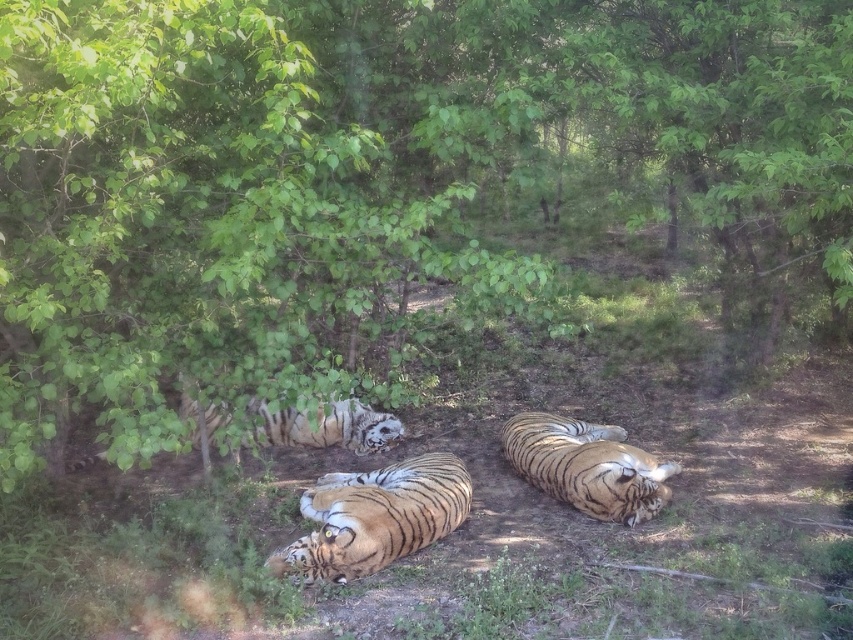
You are a GUI agent. You are given a task and a screenshot of the screen. Output one action in this format:
    pyautogui.click(x=<x>, y=<y>)
    Task: Click on the orange striped tiger at center
    The height and width of the screenshot is (640, 853).
    Given the screenshot: What is the action you would take?
    pyautogui.click(x=375, y=516)

Can you confirm if orange striped tiger at center is positioned below white fur tiger at center?

Yes.

Identify the location of orange striped tiger at center. This screenshot has height=640, width=853. (375, 516).

Who is more forward, (556, 481) or (292, 412)?

Point (556, 481) is more forward.

Is point (538, 451) positioned before point (392, 416)?

Yes, it is.

The image size is (853, 640). In order to click on orange striped tiger at lower right in this screenshot , I will do `click(587, 467)`.

Is point (322, 506) closer to viewer compared to point (602, 458)?

That is True.

Does orange striped tiger at center have a lesser width compared to orange striped tiger at lower right?

Yes, orange striped tiger at center is thinner than orange striped tiger at lower right.

Between point (309, 576) and point (521, 445), which one is positioned in front?

Point (309, 576) is in front.

At what (x,y) coordinates should I click in order to perform the action: click on orange striped tiger at center. Please return your answer as a coordinate pair (x, y). This screenshot has height=640, width=853. Looking at the image, I should click on (375, 516).